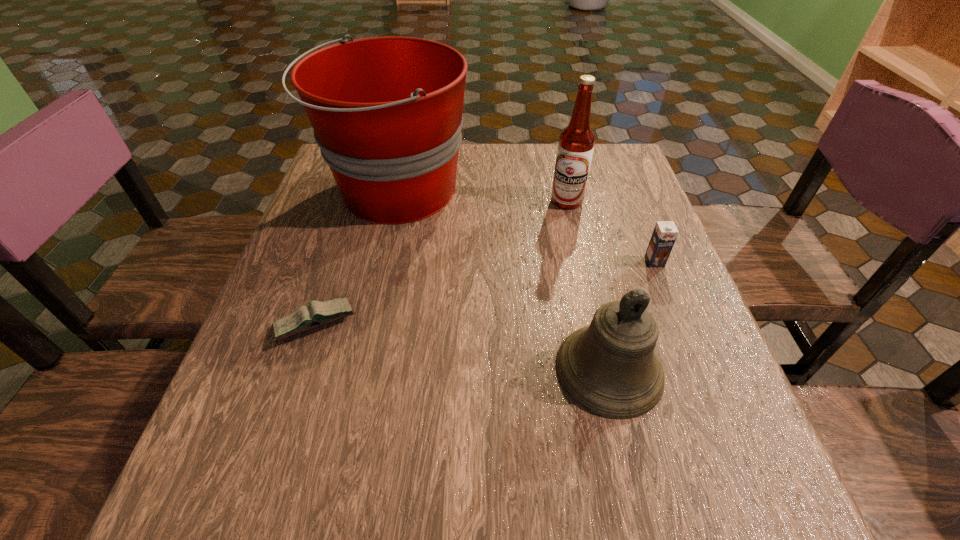
Where is `bucket`? The height and width of the screenshot is (540, 960). bucket is located at coordinates (387, 111).

Find the location of `alcohol`. alcohol is located at coordinates (576, 143).

Identify the location of bell. (610, 367).

Identify the location of the rightmost object. This screenshot has width=960, height=540. (665, 233).

This screenshot has width=960, height=540. I want to click on the second shortest object, so tap(665, 233).

Where is `diary`? This screenshot has width=960, height=540. diary is located at coordinates (304, 318).

At what (x,y) coordinates should I click in order to perform the action: click on free space located 0.250m on the right of the bucket. Please return your answer as a coordinate pair (x, y). This screenshot has width=960, height=540. Looking at the image, I should click on (566, 192).

Find the location of a particular element. vacant space situated 0.150m on the label side of the alcohol is located at coordinates (579, 252).

Where is `vacant space positioned on the front of the third shortest object`? vacant space positioned on the front of the third shortest object is located at coordinates (639, 500).

Identify the location of vacant space situated on the front label of the chocolate milk. The image size is (960, 540). (715, 416).